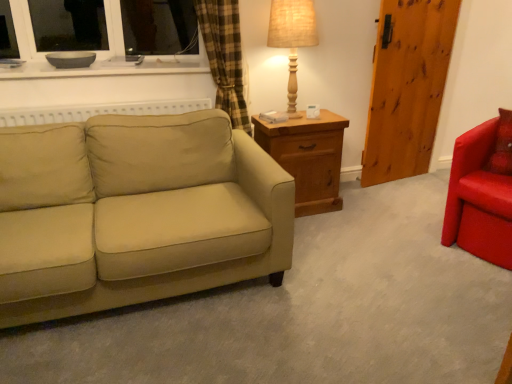
Locate an element on the screen. The image size is (512, 384). vacant area that is situated to the right of beige fabric couch at left is located at coordinates (350, 277).